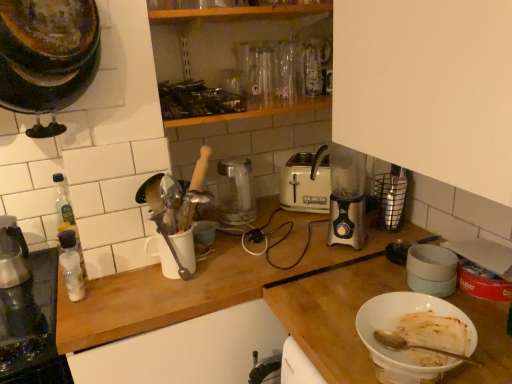
Identify the location of vacant space in rusty metal pot at upper left, arranged as the 1th kitchen appliance when viewed from the left (from a real-world perspective). The height and width of the screenshot is (384, 512). (92, 293).